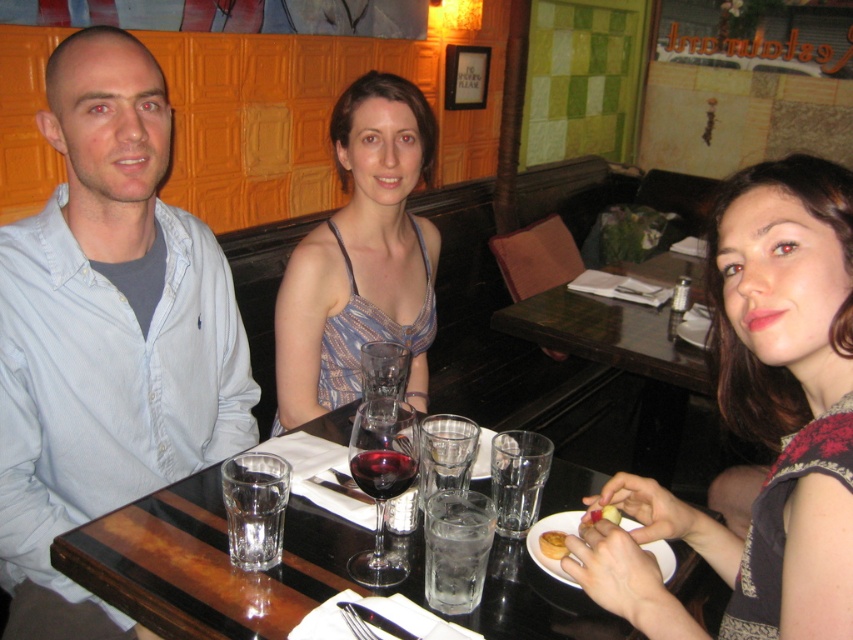
You are a waiter at the restaurant and need to place a new drink order for the person wearing the matte black dress at center. However, there is a smooth apple at lower right on the table. Where should you place the drink to avoid covering the apple?

The matte black dress at center is positioned over the smooth apple at lower right, so placing the drink near the matte black dress at center would avoid covering the apple.